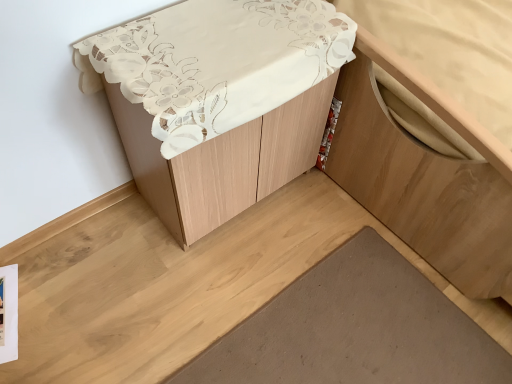
Question: In the image, is matte white cabinet at center on the left side or the right side of brown matte wood plank at lower center?

Choices:
 (A) right
 (B) left

Answer: (B)

Question: Is matte white cabinet at center taller or shorter than brown matte wood plank at lower center?

Choices:
 (A) tall
 (B) short

Answer: (A)

Question: Considering the real-world distances, which object is farthest from the brown matte wood plank at lower center?

Choices:
 (A) wooden cabinet at lower right
 (B) matte white cabinet at center

Answer: (B)

Question: Estimate the real-world distances between objects in this image. Which object is closer to the brown matte wood plank at lower center?

Choices:
 (A) wooden cabinet at lower right
 (B) matte white cabinet at center

Answer: (A)